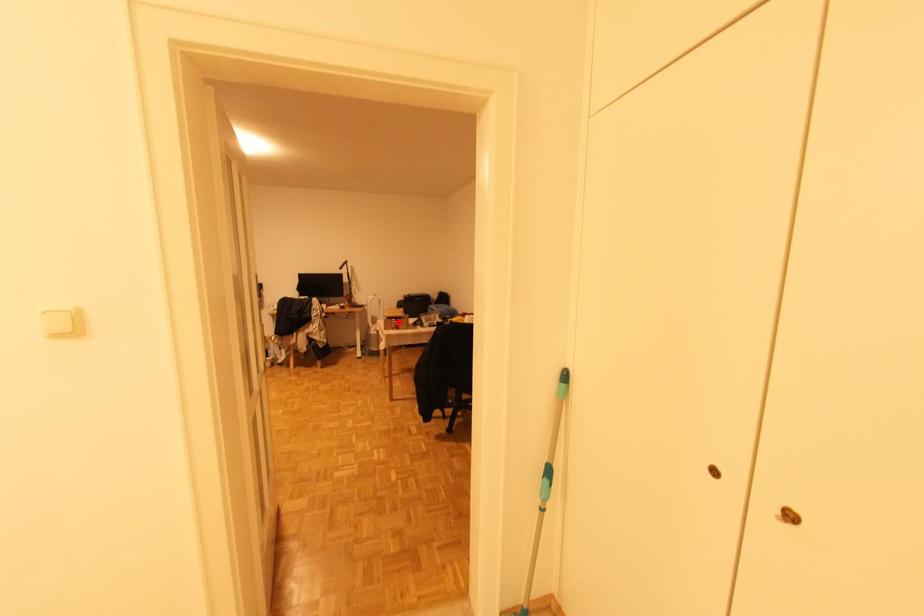
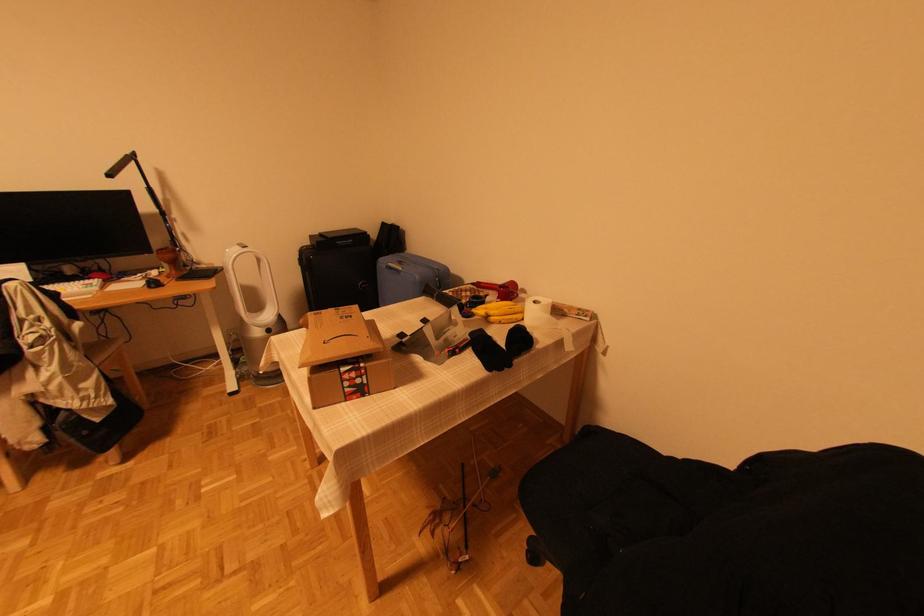
Where in the second image is the point corresponding to the highlighted location from the first image?

(356, 376)